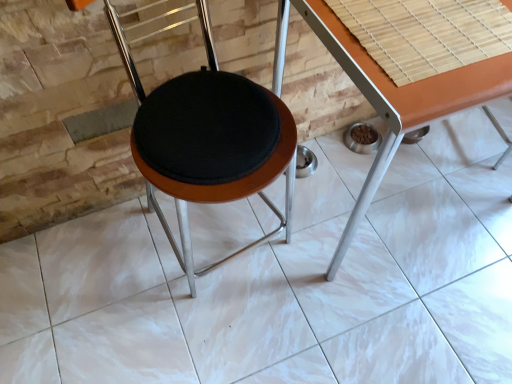
Where is `vacant region to the left of black fabric cushion at center`? The image size is (512, 384). vacant region to the left of black fabric cushion at center is located at coordinates (104, 266).